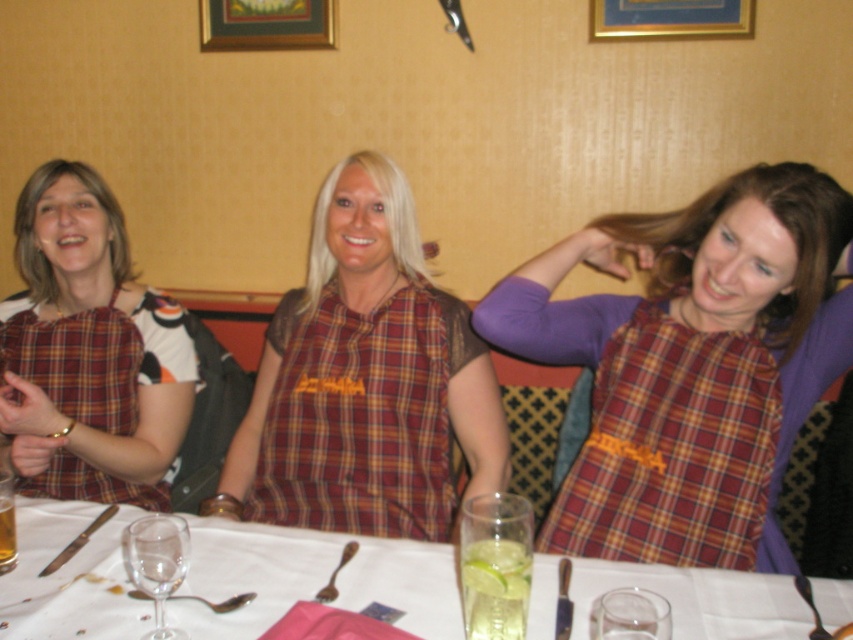
Question: Does plaid fabric dress at left appear on the left side of clear glass wine glass at center?

Choices:
 (A) no
 (B) yes

Answer: (B)

Question: Which of these objects is positioned farthest from the clear glass wine glass at center?

Choices:
 (A) plaid fabric dress at center
 (B) transparent glass at table center
 (C) plaid fabric shirt at center

Answer: (A)

Question: Is clear glass at center bigger than plaid fabric dress at left?

Choices:
 (A) no
 (B) yes

Answer: (A)

Question: Can you confirm if plaid fabric dress at left is positioned below transparent glass at table center?

Choices:
 (A) no
 (B) yes

Answer: (A)

Question: Estimate the real-world distances between objects in this image. Which object is closer to the clear glass wine glass at center?

Choices:
 (A) plaid fabric dress at left
 (B) clear glass at center

Answer: (B)

Question: Which point appears closest to the camera in this image?

Choices:
 (A) (123, 308)
 (B) (70, 512)

Answer: (B)